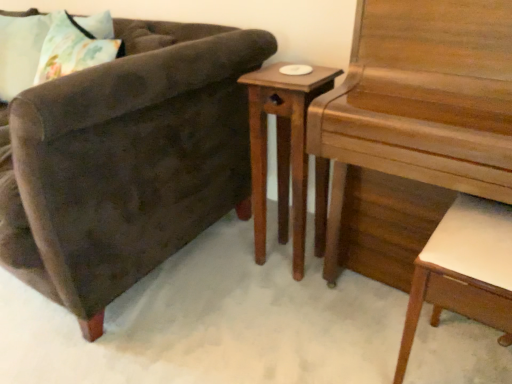
At what (x,y) coordinates should I click in order to perform the action: click on unoccupied area in front of wooden nightstand at center. Please return your answer as a coordinate pair (x, y). This screenshot has width=512, height=384. Looking at the image, I should click on (294, 299).